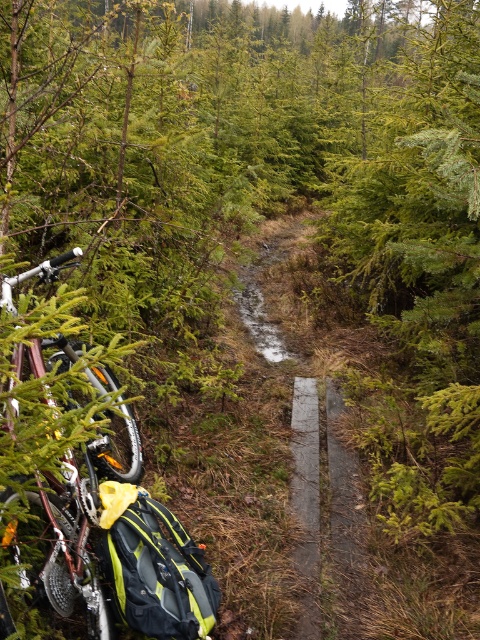
You are a hiker carrying a heavy backpack and need to cross the path. You see a brown wooden plank at center and a smooth concrete path at center. Which one is closer to you and safer to walk on?

The brown wooden plank at center is closer to you than the smooth concrete path at center. Since the wooden plank is closer, it might be safer to step onto it first to avoid slipping on the muddy path. However, the concrete path is smoother, so it might provide a more stable surface depending on its condition.

You are standing on the forest path and see the silver metallic bicycle at left. If you want to reach the bicycle, how many steps would you need to take if each step covers 0.75 meters?

The distance between you and the silver metallic bicycle at left is 1.53 meters. Since each step covers 0.75 meters, you would need to take 2 steps to reach it.